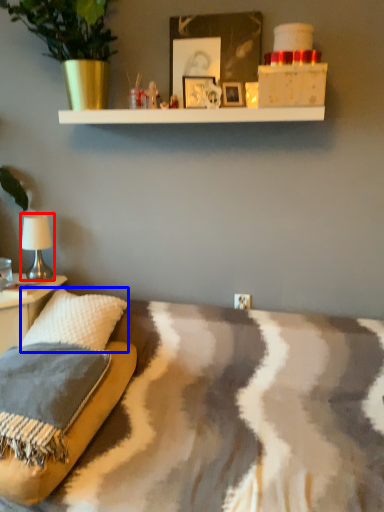
Question: Which point is further to the camera, table lamp (highlighted by a red box) or throw pillow (highlighted by a blue box)?

Choices:
 (A) table lamp
 (B) throw pillow

Answer: (A)